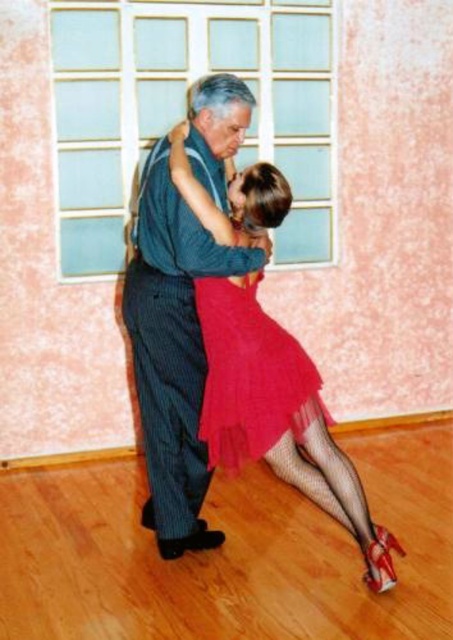
Question: Which of the following is the farthest from the observer?

Choices:
 (A) (188, 326)
 (B) (197, 116)

Answer: (A)

Question: Does matte red dress at center have a larger size compared to shiny tulle skirt at center?

Choices:
 (A) no
 (B) yes

Answer: (B)

Question: Considering the relative positions of matte red dress at center and shiny tulle skirt at center in the image provided, where is matte red dress at center located with respect to shiny tulle skirt at center?

Choices:
 (A) right
 (B) left

Answer: (B)

Question: Which of the following is the farthest from the observer?

Choices:
 (A) (283, 342)
 (B) (159, 172)

Answer: (A)

Question: Does matte red dress at center come behind striped fabric pants at center?

Choices:
 (A) yes
 (B) no

Answer: (A)

Question: Which object appears closest to the camera in this image?

Choices:
 (A) striped fabric pants at center
 (B) shiny tulle skirt at center
 (C) matte red dress at center

Answer: (A)